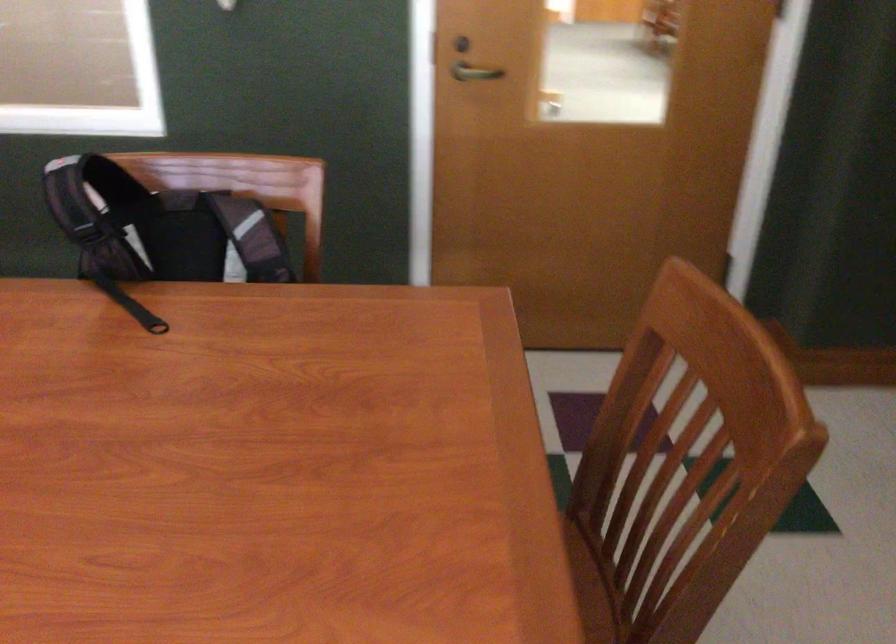
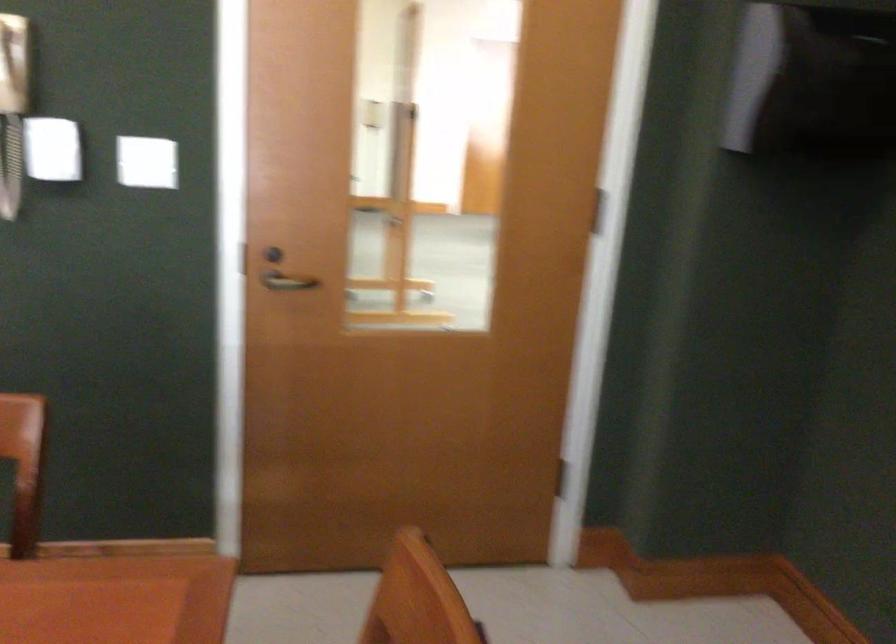
Question: The images are taken continuously from a first-person perspective. In which direction is your viewpoint rotating?

Choices:
 (A) Left
 (B) Right
 (C) Up
 (D) Down

Answer: (C)